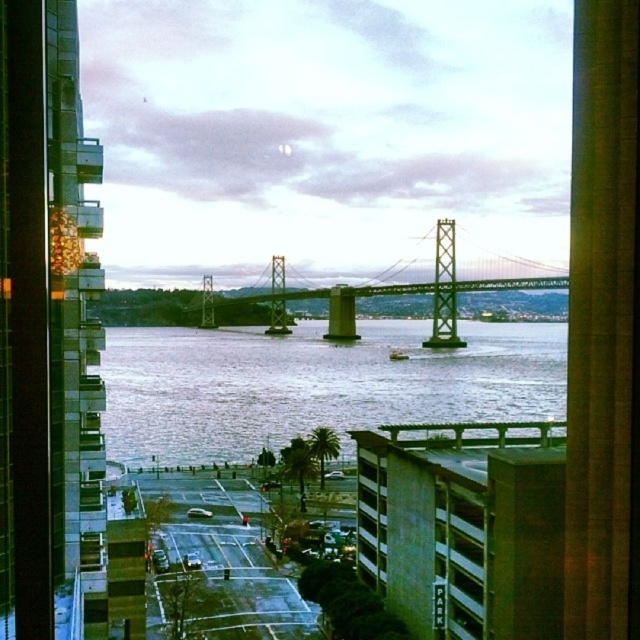
Question: Based on their relative distances, which object is farther from the gray water at center?

Choices:
 (A) metallic gray suspension bridge at center
 (B) green matte parking garage at lower right

Answer: (B)

Question: From the image, what is the correct spatial relationship of metallic gray suspension bridge at center in relation to green matte parking garage at lower right?

Choices:
 (A) below
 (B) above

Answer: (B)

Question: Which point is farther to the camera?

Choices:
 (A) (436, 509)
 (B) (516, 284)
 (C) (204, 378)

Answer: (B)

Question: Is gray water at center above metallic gray suspension bridge at center?

Choices:
 (A) yes
 (B) no

Answer: (B)

Question: Among these objects, which one is nearest to the camera?

Choices:
 (A) green matte parking garage at lower right
 (B) metallic gray suspension bridge at center
 (C) gray water at center
 (D) green glass window at center

Answer: (A)

Question: Does gray water at center have a larger size compared to green matte parking garage at lower right?

Choices:
 (A) yes
 (B) no

Answer: (A)